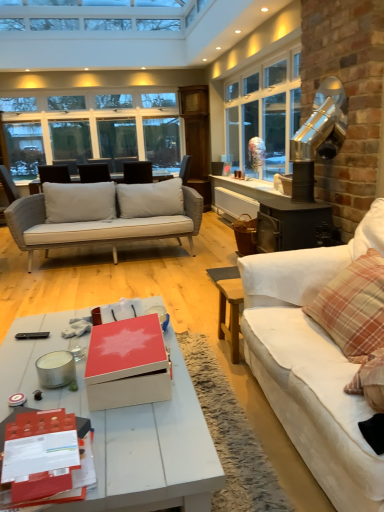
At what (x,y) coordinates should I click in order to perform the action: click on vacant area that is in front of black plastic remote control at lower left. Please return your answer as a coordinate pair (x, y). Looking at the image, I should click on (13, 356).